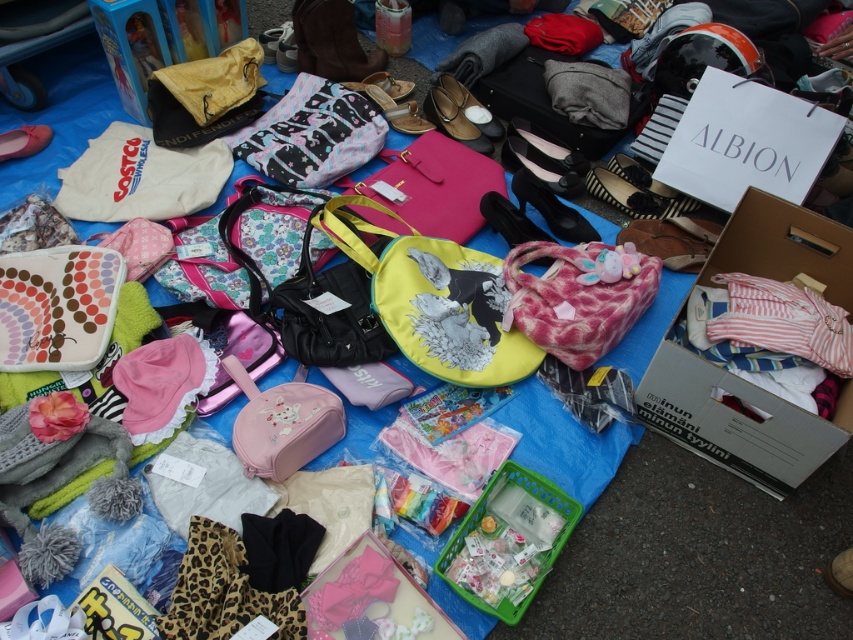
Question: Which point appears farthest from the camera in this image?

Choices:
 (A) (601, 342)
 (B) (300, 122)
 (C) (76, 282)
 (D) (467, 356)

Answer: (B)

Question: Is yellow fabric bag at center bigger than pink fabric purse at center?

Choices:
 (A) yes
 (B) no

Answer: (A)

Question: Does yellow fabric bag at center have a lesser width compared to matte fabric bag at center-left?

Choices:
 (A) no
 (B) yes

Answer: (A)

Question: Does matte fabric bag at center-left appear over matte pink fabric bag at center?

Choices:
 (A) no
 (B) yes

Answer: (A)

Question: Which point appears farthest from the camera in this image?

Choices:
 (A) (236, 380)
 (B) (103, 276)

Answer: (B)

Question: Among these objects, which one is farthest from the camera?

Choices:
 (A) yellow fabric bag at center
 (B) matte pink fabric bag at center
 (C) matte fabric bag at center-left
 (D) pink fabric purse at center

Answer: (B)